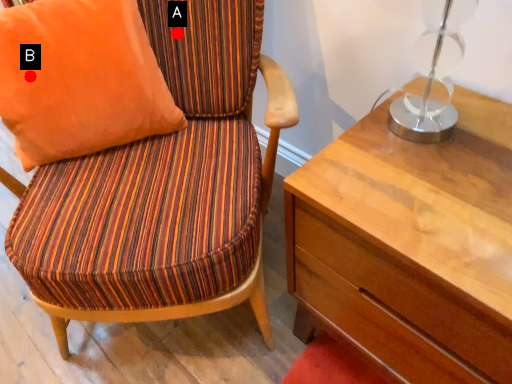
Question: Two points are circled on the image, labeled by A and B beside each circle. Which point is closer to the camera?

Choices:
 (A) A is closer
 (B) B is closer

Answer: (B)